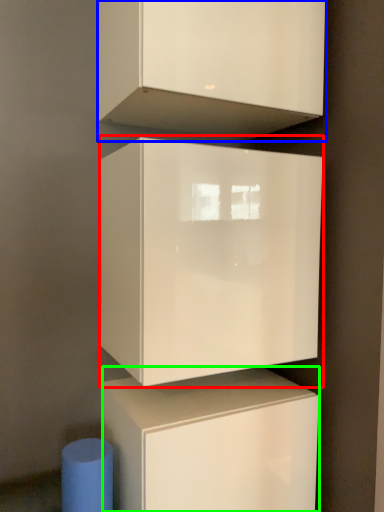
Question: Estimate the real-world distances between objects in this image. Which object is farther from cabinetry (highlighted by a red box), cabinetry (highlighted by a blue box) or cabinetry (highlighted by a green box)?

Choices:
 (A) cabinetry
 (B) cabinetry

Answer: (A)